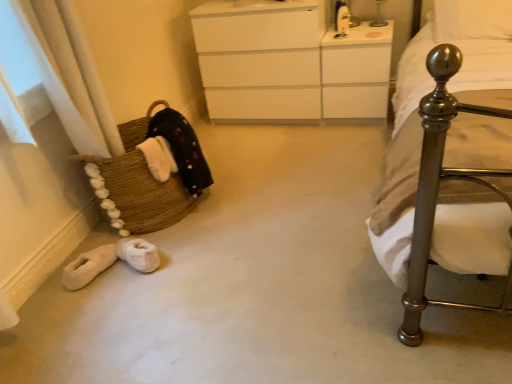
Locate an element on the screen. The image size is (512, 384). vacant space that is in between white glossy vanity at upper center and brown woven basket at left is located at coordinates (273, 160).